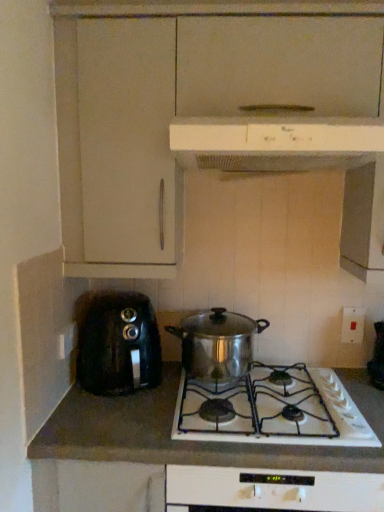
Image resolution: width=384 pixels, height=512 pixels. In order to click on vacant space in stainless steel pot at center, placed as the first kitchen appliance when sorted from bottom to top (from a real-world perspective) in this screenshot , I will do pyautogui.click(x=213, y=375).